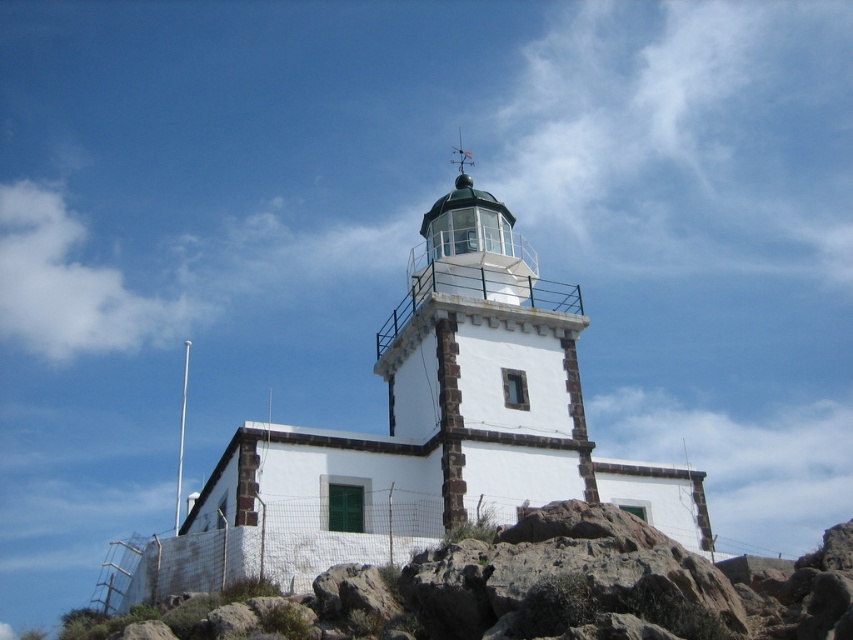
Question: Does rocky terrain at lower right lie behind white stone lighthouse at center?

Choices:
 (A) yes
 (B) no

Answer: (B)

Question: Among these objects, which one is farthest from the camera?

Choices:
 (A) white stone lighthouse at center
 (B) rocky terrain at lower right

Answer: (A)

Question: Which object is closer to the camera taking this photo?

Choices:
 (A) white stone lighthouse at center
 (B) rocky terrain at lower right

Answer: (B)

Question: Is rocky terrain at lower right to the left of white stone lighthouse at center from the viewer's perspective?

Choices:
 (A) no
 (B) yes

Answer: (B)

Question: Is rocky terrain at lower right to the left of white stone lighthouse at center from the viewer's perspective?

Choices:
 (A) yes
 (B) no

Answer: (A)

Question: Which object appears closest to the camera in this image?

Choices:
 (A) white stone lighthouse at center
 (B) rocky terrain at lower right

Answer: (B)